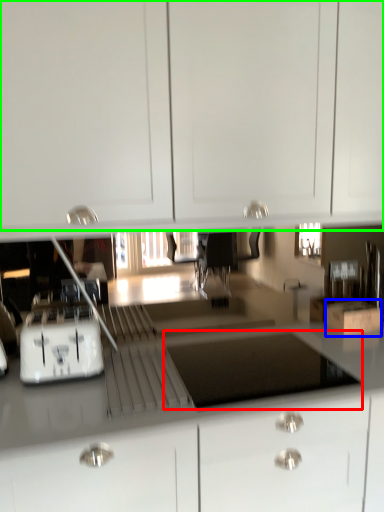
Question: Considering the real-world distances, which object is closest to appliance (highlighted by a red box)? cardboard box (highlighted by a blue box) or cabinetry (highlighted by a green box).

Choices:
 (A) cardboard box
 (B) cabinetry

Answer: (A)